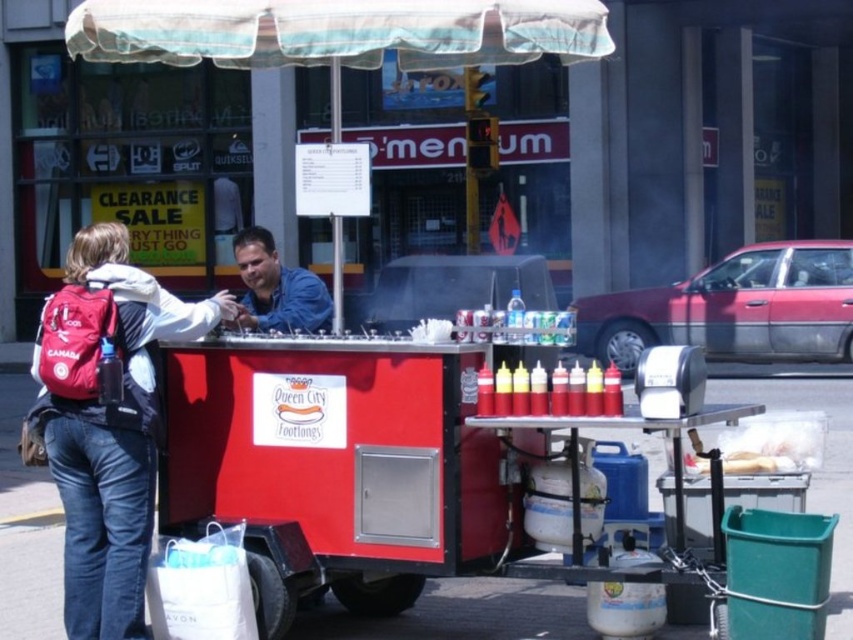
Between denim jacket at left and blue denim shirt at center, which one has less height?

Standing shorter between the two is denim jacket at left.

Does point (131, 458) come closer to viewer compared to point (260, 282)?

That is True.

The height and width of the screenshot is (640, 853). In order to click on denim jacket at left in this screenshot , I will do `click(105, 422)`.